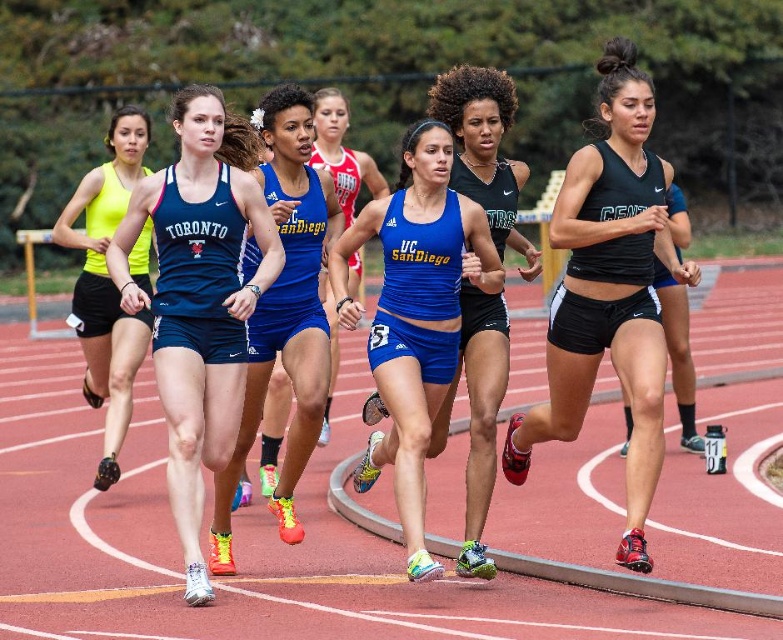
Question: Among these points, which one is nearest to the camera?

Choices:
 (A) (128, 355)
 (B) (236, 307)
 (C) (352, 189)
 (D) (715, 536)

Answer: (B)

Question: Is red rubber track at center to the right of matte blue tank top at center from the viewer's perspective?

Choices:
 (A) yes
 (B) no

Answer: (A)

Question: Is blue fabric uniform at center to the right of neon yellow tank top at left from the viewer's perspective?

Choices:
 (A) yes
 (B) no

Answer: (A)

Question: Which object is the closest to the neon yellow tank top at left?

Choices:
 (A) black matte tank top at center
 (B) matte blue tank top at center
 (C) blue fabric uniform at center

Answer: (C)

Question: Which object is farther from the camera taking this photo?

Choices:
 (A) blue fabric uniform at center
 (B) neon yellow tank top at left

Answer: (B)

Question: Does blue fabric uniform at center lie in front of neon yellow tank top at left?

Choices:
 (A) yes
 (B) no

Answer: (A)